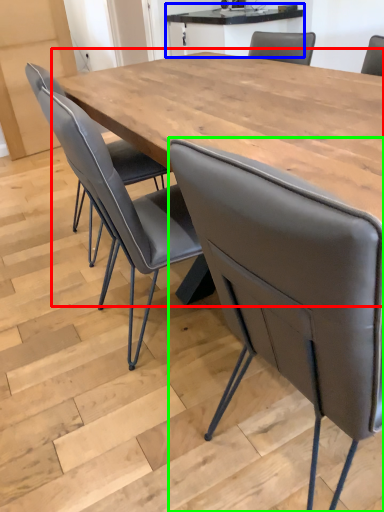
Question: Estimate the real-world distances between objects in this image. Which object is farther from table (highlighted by a red box), table (highlighted by a blue box) or chair (highlighted by a green box)?

Choices:
 (A) table
 (B) chair

Answer: (A)